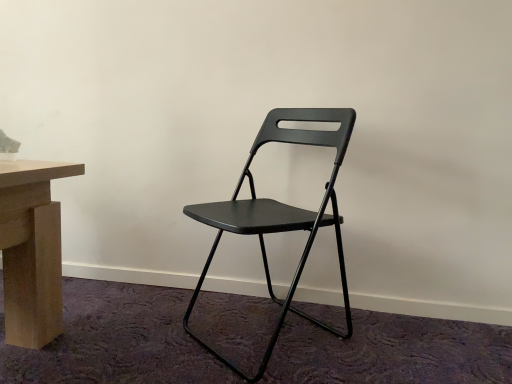
What is the approximate width of matte black folding chair at center?

matte black folding chair at center is 19.47 inches in width.

The width and height of the screenshot is (512, 384). What do you see at coordinates (280, 213) in the screenshot?
I see `matte black folding chair at center` at bounding box center [280, 213].

Identify the location of matte black folding chair at center. The image size is (512, 384). (280, 213).

What are the coordinates of `matte black folding chair at center` in the screenshot? It's located at (280, 213).